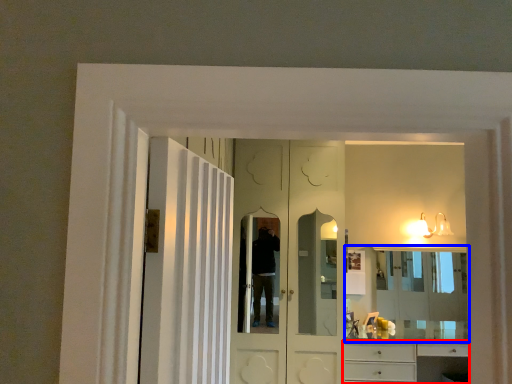
Question: Which of the following is the closest to the observer, cabinetry (highlighted by a red box) or mirror (highlighted by a blue box)?

Choices:
 (A) cabinetry
 (B) mirror

Answer: (A)